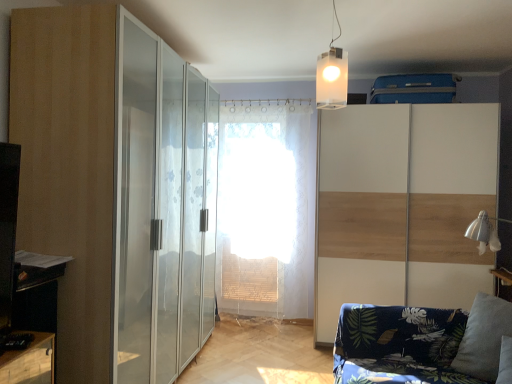
The height and width of the screenshot is (384, 512). What do you see at coordinates (116, 188) in the screenshot?
I see `matte glass door at left` at bounding box center [116, 188].

The image size is (512, 384). What do you see at coordinates (265, 209) in the screenshot? I see `white sheer curtain at center` at bounding box center [265, 209].

At what (x,y) coordinates should I click in order to perform the action: click on dark blue fabric couch at lower right. Please return your answer as a coordinate pair (x, y). The height and width of the screenshot is (384, 512). Looking at the image, I should click on (421, 343).

Where is `translucent plastic cube at upper center`? The image size is (512, 384). translucent plastic cube at upper center is located at coordinates (332, 75).

I want to click on transparent glass wardrobe at center, the 2th screen door viewed from the right, so [162, 208].

Is white sheer curtain at center at the back of white wood screen door at right, the 1th screen door when ordered from right to left?

No, white wood screen door at right, the 1th screen door when ordered from right to left, is not facing the opposite direction of white sheer curtain at center.

Is white wood screen door at right, the 1th screen door when ordered from right to left, further to camera compared to white sheer curtain at center?

No, the depth of white wood screen door at right, the 1th screen door when ordered from right to left, is less than that of white sheer curtain at center.

Considering the sizes of objects white wood screen door at right, the 1th screen door when ordered from right to left, and white sheer curtain at center in the image provided, who is taller, white wood screen door at right, the 1th screen door when ordered from right to left, or white sheer curtain at center?

Standing taller between the two is white sheer curtain at center.

Does point (489, 106) come farther from viewer compared to point (233, 165)?

No, (489, 106) is closer to viewer.

What's the angular difference between matte glass door at left and transparent glass wardrobe at center, the 2th screen door viewed from the right,'s facing directions?

0.000314 degrees separate the facing orientations of matte glass door at left and transparent glass wardrobe at center, the 2th screen door viewed from the right.

From the image's perspective, is matte glass door at left beneath transparent glass wardrobe at center, which is counted as the 1th screen door, starting from the left?

Yes, from the image's perspective, matte glass door at left is beneath transparent glass wardrobe at center, which is counted as the 1th screen door, starting from the left.

Which of these two, matte glass door at left or transparent glass wardrobe at center, which is counted as the 1th screen door, starting from the left, stands taller?

With more height is transparent glass wardrobe at center, which is counted as the 1th screen door, starting from the left.

Which object is more forward, matte glass door at left or transparent glass wardrobe at center, the 2th screen door viewed from the right?

matte glass door at left is in front.

From the image's perspective, is matte glass door at left on top of white wood screen door at right, the 1th screen door when ordered from right to left?

Yes, from the image's perspective, matte glass door at left is over white wood screen door at right, the 1th screen door when ordered from right to left.

Would you say matte glass door at left is inside or outside white wood screen door at right, the 1th screen door when ordered from right to left?

matte glass door at left is not enclosed by white wood screen door at right, the 1th screen door when ordered from right to left.

From a real-world perspective, which is physically above, matte glass door at left or white wood screen door at right, the 1th screen door when ordered from right to left?

matte glass door at left, from a real-world perspective.

How many degrees apart are the facing directions of transparent glass wardrobe at center, which is counted as the 1th screen door, starting from the left, and white sheer curtain at center?

The angle between the facing direction of transparent glass wardrobe at center, which is counted as the 1th screen door, starting from the left, and the facing direction of white sheer curtain at center is 86.8 degrees.

In the image, is transparent glass wardrobe at center, the 2th screen door viewed from the right, positioned in front of or behind white sheer curtain at center?

In the image, transparent glass wardrobe at center, the 2th screen door viewed from the right, appears in front of white sheer curtain at center.

Find the location of a particular element. The height and width of the screenshot is (384, 512). the 2nd screen door in front of the white sheer curtain at center, counting from the anchor's position is located at coordinates (162, 208).

In the image, is transparent glass wardrobe at center, which is counted as the 1th screen door, starting from the left, on the left side or the right side of white sheer curtain at center?

transparent glass wardrobe at center, which is counted as the 1th screen door, starting from the left, is to the left of white sheer curtain at center.

Is dark blue fabric couch at lower right with white wood screen door at right, acting as the second screen door starting from the left?

No, dark blue fabric couch at lower right is not in contact with white wood screen door at right, acting as the second screen door starting from the left.

Considering the relative positions of dark blue fabric couch at lower right and white wood screen door at right, the 1th screen door when ordered from right to left, in the image provided, is dark blue fabric couch at lower right behind white wood screen door at right, the 1th screen door when ordered from right to left,?

No, the depth of dark blue fabric couch at lower right is less than that of white wood screen door at right, the 1th screen door when ordered from right to left.

From the image's perspective, does dark blue fabric couch at lower right appear higher than white wood screen door at right, acting as the second screen door starting from the left?

No.

Identify the location of curtain above the gray fabric pillow at lower right (from the image's perspective). (265, 209).

From a real-world perspective, relative to white sheer curtain at center, is gray fabric pillow at lower right vertically above or below?

gray fabric pillow at lower right is situated lower than white sheer curtain at center in the real world.

Is gray fabric pillow at lower right facing away from white sheer curtain at center?

No, gray fabric pillow at lower right's orientation is not away from white sheer curtain at center.

Does gray fabric pillow at lower right have a greater width compared to white sheer curtain at center?

Yes, gray fabric pillow at lower right is wider than white sheer curtain at center.

Based on the photo, can you confirm if white sheer curtain at center is shorter than transparent glass wardrobe at center, which is counted as the 1th screen door, starting from the left?

Correct, white sheer curtain at center is not as tall as transparent glass wardrobe at center, which is counted as the 1th screen door, starting from the left.

Could transparent glass wardrobe at center, which is counted as the 1th screen door, starting from the left, be considered to be inside white sheer curtain at center?

No, transparent glass wardrobe at center, which is counted as the 1th screen door, starting from the left, is not a part of white sheer curtain at center.

Is the position of white sheer curtain at center less distant than that of transparent glass wardrobe at center, which is counted as the 1th screen door, starting from the left?

No, the depth of white sheer curtain at center is greater than that of transparent glass wardrobe at center, which is counted as the 1th screen door, starting from the left.

At what (x,y) coordinates should I click in order to perform the action: click on screen door that is the 2nd one when counting downward from the white sheer curtain at center (from the image's perspective). Please return your answer as a coordinate pair (x, y). Looking at the image, I should click on (402, 205).

You are a GUI agent. You are given a task and a screenshot of the screen. Output one action in this format:
    pyautogui.click(x=<x>, y=<y>)
    Task: Click on the door that appears on the left of transparent glass wardrobe at center, the 2th screen door viewed from the right
    The image size is (512, 384).
    Given the screenshot: What is the action you would take?
    pyautogui.click(x=116, y=188)

Which object lies nearer to the anchor point matte glass door at left, transparent glass wardrobe at center, the 2th screen door viewed from the right, or translucent plastic cube at upper center?

Based on the image, transparent glass wardrobe at center, the 2th screen door viewed from the right, appears to be nearer to matte glass door at left.

Looking at the image, which one is located further to translucent plastic cube at upper center, matte glass door at left or transparent glass wardrobe at center, the 2th screen door viewed from the right?

matte glass door at left.

When comparing their distances from white sheer curtain at center, does white wood screen door at right, the 1th screen door when ordered from right to left, or transparent glass wardrobe at center, the 2th screen door viewed from the right, seem further?

transparent glass wardrobe at center, the 2th screen door viewed from the right.

Looking at this image, considering their positions, is transparent glass wardrobe at center, the 2th screen door viewed from the right, positioned closer to matte glass door at left than dark blue fabric couch at lower right?

Based on the image, transparent glass wardrobe at center, the 2th screen door viewed from the right, appears to be nearer to matte glass door at left.

Which object lies nearer to the anchor point matte glass door at left, white sheer curtain at center or translucent plastic cube at upper center?

translucent plastic cube at upper center lies closer to matte glass door at left than the other object.

Estimate the real-world distances between objects in this image. Which object is further from dark blue fabric couch at lower right, matte glass door at left or transparent glass wardrobe at center, which is counted as the 1th screen door, starting from the left?

Based on the image, matte glass door at left appears to be further to dark blue fabric couch at lower right.

Estimate the real-world distances between objects in this image. Which object is further from gray fabric pillow at lower right, matte glass door at left or transparent glass wardrobe at center, the 2th screen door viewed from the right?

Among the two, matte glass door at left is located further to gray fabric pillow at lower right.

From the image, which object appears to be farther from white wood screen door at right, the 1th screen door when ordered from right to left, white sheer curtain at center or gray fabric pillow at lower right?

The object further to white wood screen door at right, the 1th screen door when ordered from right to left, is gray fabric pillow at lower right.

The height and width of the screenshot is (384, 512). Find the location of `curtain located between transparent glass wardrobe at center, which is counted as the 1th screen door, starting from the left, and white wood screen door at right, the 1th screen door when ordered from right to left, in the left-right direction`. curtain located between transparent glass wardrobe at center, which is counted as the 1th screen door, starting from the left, and white wood screen door at right, the 1th screen door when ordered from right to left, in the left-right direction is located at coordinates (265, 209).

In order to click on studio couch between matte glass door at left and gray fabric pillow at lower right from left to right in this screenshot , I will do `click(421, 343)`.

What are the coordinates of `light fixture between transparent glass wardrobe at center, which is counted as the 1th screen door, starting from the left, and gray fabric pillow at lower right from left to right` in the screenshot? It's located at (332, 75).

Locate an element on the screen. Image resolution: width=512 pixels, height=384 pixels. pillow between transparent glass wardrobe at center, which is counted as the 1th screen door, starting from the left, and white wood screen door at right, acting as the second screen door starting from the left is located at coordinates (483, 336).